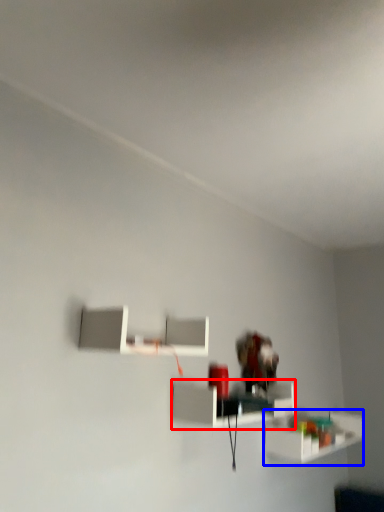
Question: Which object appears farthest to the camera in this image, shelf (highlighted by a red box) or shelf (highlighted by a blue box)?

Choices:
 (A) shelf
 (B) shelf

Answer: (B)